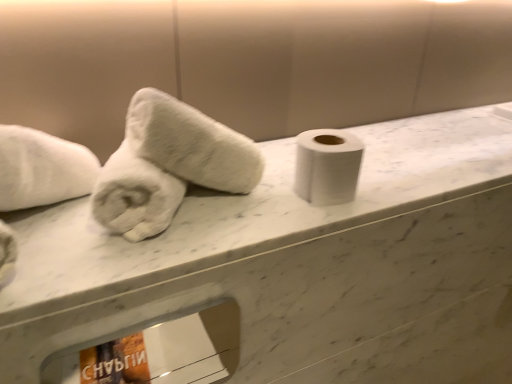
The width and height of the screenshot is (512, 384). What are the coordinates of `spots to the right of white matte toilet paper at center` in the screenshot? It's located at (402, 181).